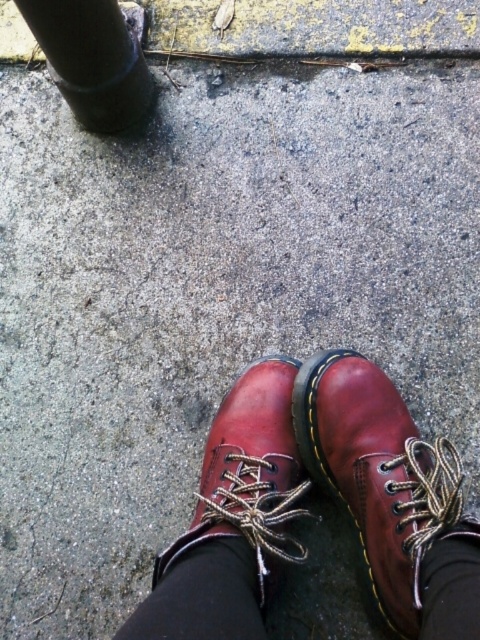
From the picture: You are a delivery robot with a 50 cm wide package that needs to be placed between the shiny leather boot at center and the black matte pole at upper left. Can the package fit in the space between them?

The distance between the shiny leather boot at center and the black matte pole at upper left is 71.53 centimeters. Since the package is 50 cm wide, it can fit in the space between them as 71.53 cm is greater than 50 cm.

You are a delivery robot that needs to pass between the shiny leather boot at center and the black matte pole at upper left. The robot is 0.5 meters tall. Can it pass through without hitting its top?

The shiny leather boot at center is taller than the black matte pole at upper left. Since the robot is 0.5 meters tall, it can pass under the shiny leather boot at center and the black matte pole at upper left as long as their heights are above 0.5 meters. However, since the exact heights aren

You are a shoemaker examining two items in a store window. You see a shiny brown leather shoe at center and a shiny leather boot at center. Which item has a bigger size?

The shiny brown leather shoe at center is larger in size than the shiny leather boot at center.